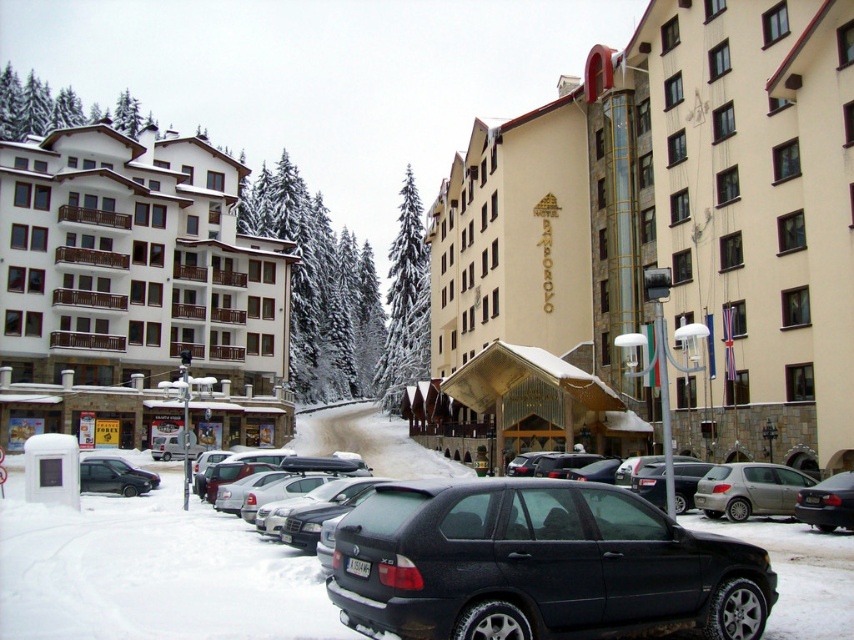
Between white stone building at left and silver metallic hatchback at center-right, which one appears on the right side from the viewer's perspective?

silver metallic hatchback at center-right is more to the right.

Does white stone building at left have a larger size compared to silver metallic hatchback at center-right?

Yes.

You are a GUI agent. You are given a task and a screenshot of the screen. Output one action in this format:
    pyautogui.click(x=<x>, y=<y>)
    Task: Click on the white stone building at left
    This screenshot has height=640, width=854.
    Given the screenshot: What is the action you would take?
    pyautogui.click(x=135, y=291)

Between point (828, 499) and point (118, 460), which one is positioned behind?

The point (118, 460) is more distant.

Is point (802, 520) positioned in front of point (132, 476)?

Yes, it is.

Locate an element on the screen. This screenshot has height=640, width=854. shiny black sedan at lower right is located at coordinates (828, 502).

Who is more distant from viewer, (290, 436) or (124, 493)?

Positioned behind is point (290, 436).

Describe the element at coordinates (135, 291) in the screenshot. This screenshot has height=640, width=854. I see `white stone building at left` at that location.

From the picture: Who is more forward, (21,275) or (100,481)?

Point (100,481) is more forward.

I want to click on white stone building at left, so click(x=135, y=291).